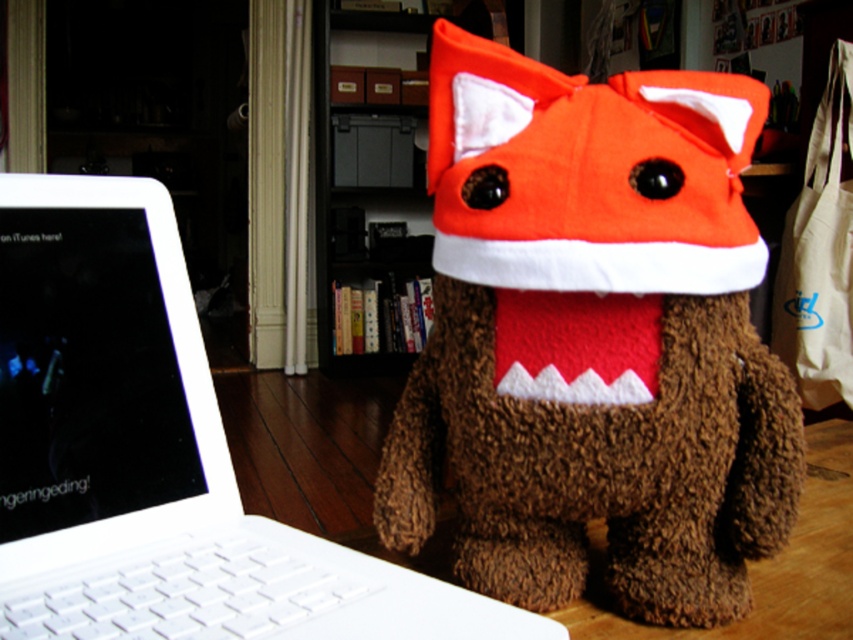
You are organizing a child birthday party and need to place a gift box between the brown fuzzy stuffed toy at center and the wooden bookshelf at center. Based on their positions, which object should the gift box be closer to?

The gift box should be closer to the wooden bookshelf at center because the brown fuzzy stuffed toy at center is positioned to the right of the wooden bookshelf at center, meaning the bookshelf is to the left of the stuffed toy. Therefore, placing the gift box closer to the bookshelf would be between them.

You are a photographer setting up a tripod to take a closeup of the orange plush hat at center. The wooden bookshelf at center is in the background. Will the bookshelf be in focus if you focus on the hat?

The orange plush hat at center is closer to the viewer than the wooden bookshelf at center. If you focus on the hat, the bookshelf will be out of focus because it is further away.

You are organizing a child birthday party and need to place the orange plush hat at center on a shelf for display. Given the current setup, can you place it on the wooden bookshelf at center?

The orange plush hat at center is located below the wooden bookshelf at center, so it is currently placed on a lower surface. To place it on the wooden bookshelf at center, you would need to move it upwards to the shelf above.